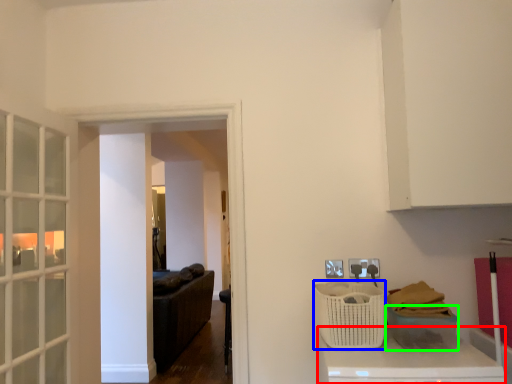
Question: Which object is the farthest from counter top (highlighted by a red box)? Choose among these: basket (highlighted by a blue box) or basket (highlighted by a green box).

Choices:
 (A) basket
 (B) basket

Answer: (A)